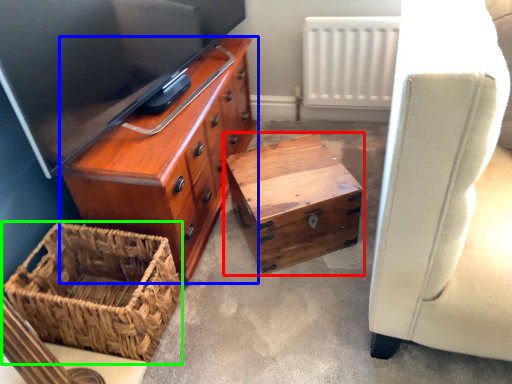
Question: Which is nearer to the table (highlighted by a red box)? chest of drawers (highlighted by a blue box) or picnic basket (highlighted by a green box).

Choices:
 (A) chest of drawers
 (B) picnic basket

Answer: (A)